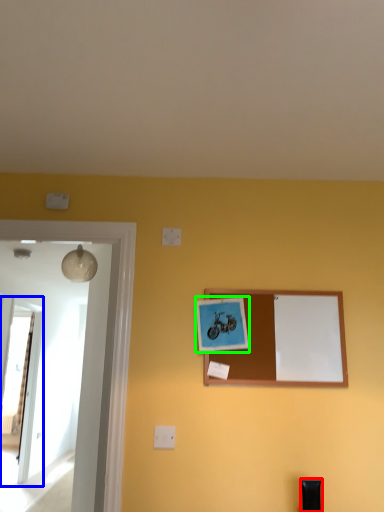
Question: Which object is the closest to the furniture (highlighted by a red box)? Choose among these: glass door (highlighted by a blue box) or picture frame (highlighted by a green box).

Choices:
 (A) glass door
 (B) picture frame

Answer: (B)